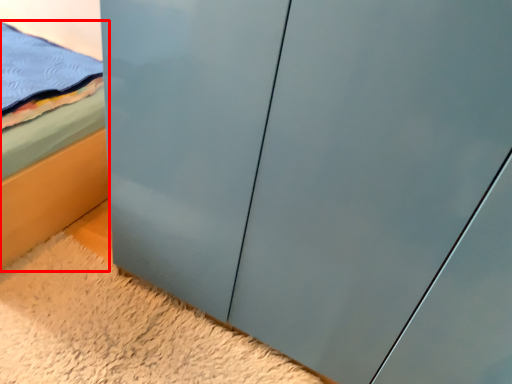
Question: Observing the image, what is the correct spatial positioning of bed (annotated by the red box) in reference to plain?

Choices:
 (A) right
 (B) left

Answer: (B)